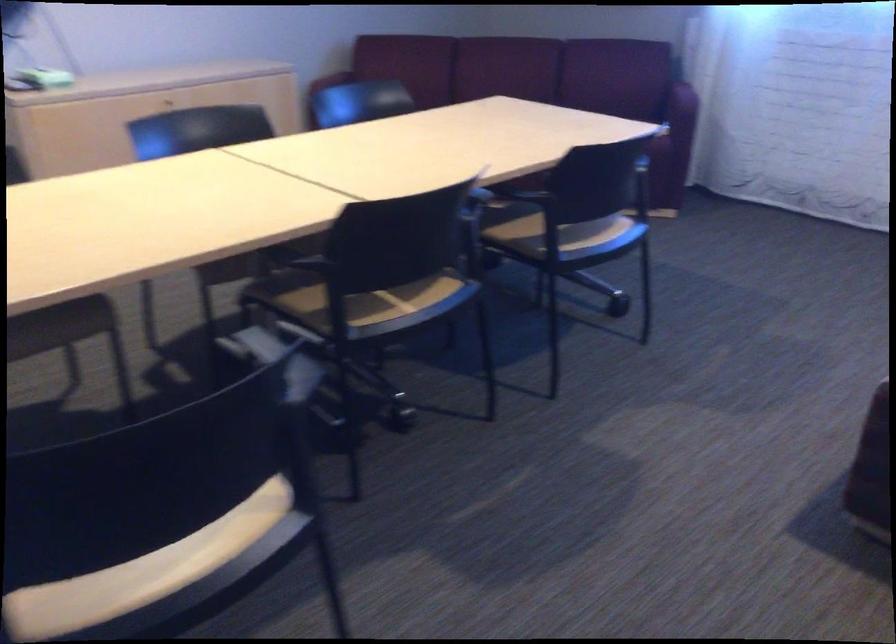
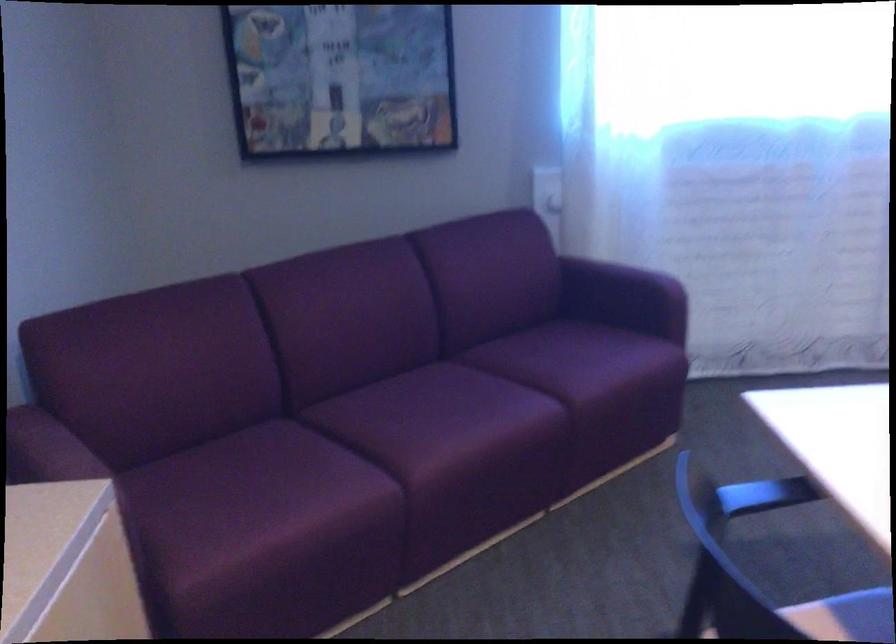
Find the pixel in the second image that matches the point at 645,97 in the first image.

(617, 289)